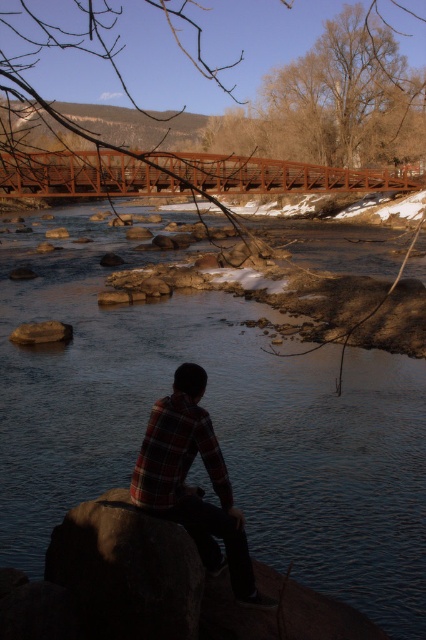
Question: Which is farther from the clear water at center?

Choices:
 (A) brown smooth rock at lower center
 (B) plaid fabric shirt at center

Answer: (B)

Question: Can you confirm if dark gray stone boulder at center is smaller than brown smooth rock at lower center?

Choices:
 (A) yes
 (B) no

Answer: (B)

Question: Which point is closer to the camera?

Choices:
 (A) click(46, 326)
 (B) click(26, 236)
 (C) click(158, 428)
 (D) click(100, 541)

Answer: (D)

Question: Is clear water at center positioned before plaid fabric shirt at center?

Choices:
 (A) no
 (B) yes

Answer: (A)

Question: Which is nearer to the dark gray stone boulder at center?

Choices:
 (A) clear water at center
 (B) plaid fabric shirt at center
 (C) brown smooth rock at lower center

Answer: (B)

Question: Does clear water at center have a larger size compared to plaid fabric shirt at center?

Choices:
 (A) no
 (B) yes

Answer: (B)